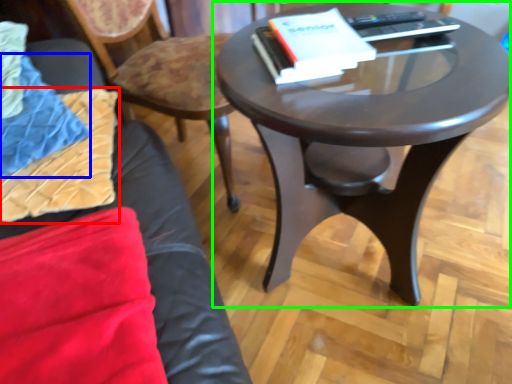
Question: Which object is the farthest from pillow (highlighted by a red box)? Choose among these: blanket (highlighted by a blue box) or coffee table (highlighted by a green box).

Choices:
 (A) blanket
 (B) coffee table

Answer: (B)